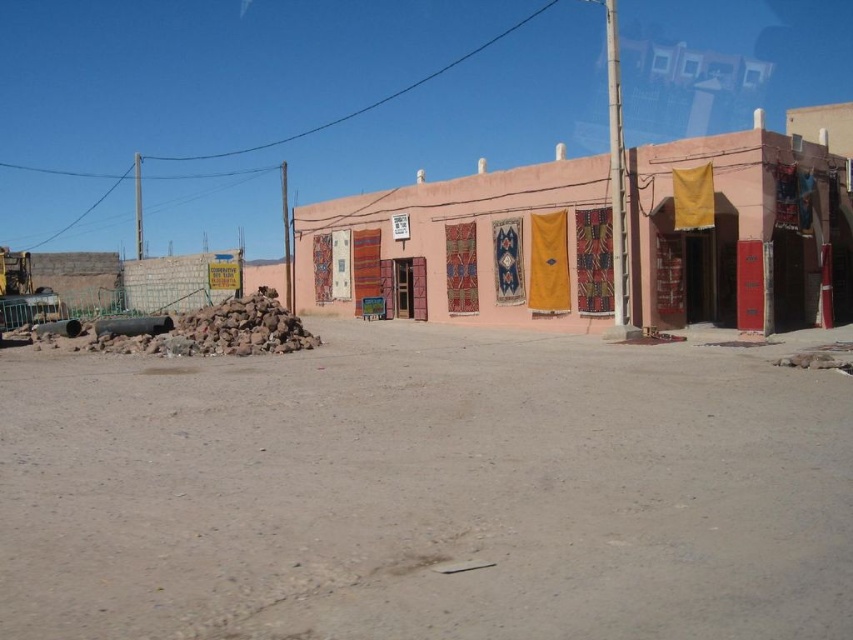
Does dull brown dirt at center appear on the right side of textured fabric clothesline at center?

Incorrect, dull brown dirt at center is not on the right side of textured fabric clothesline at center.

Between point (675, 516) and point (476, 184), which one is positioned in front?

Positioned in front is point (675, 516).

Locate an element on the screen. The image size is (853, 640). dull brown dirt at center is located at coordinates (425, 492).